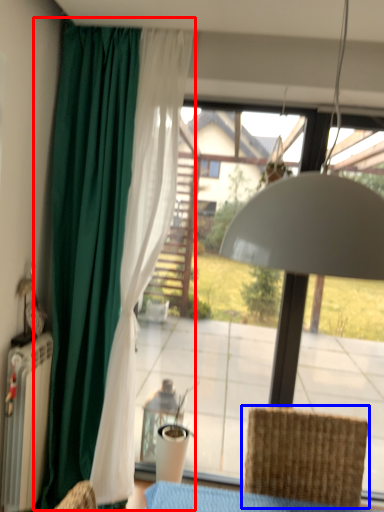
Question: Which object is further to the camera taking this photo, curtain (highlighted by a red box) or chair (highlighted by a blue box)?

Choices:
 (A) curtain
 (B) chair

Answer: (A)